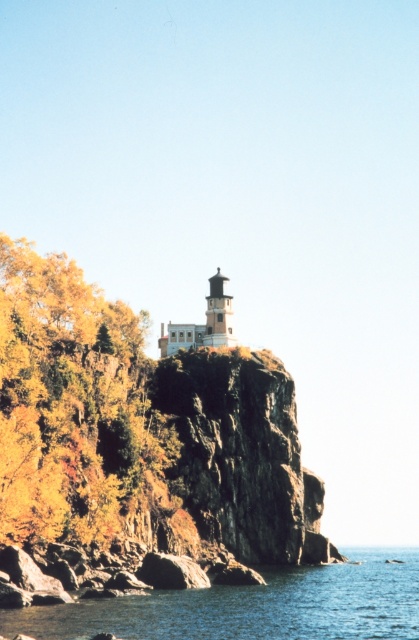
You are standing at the base of the cliff looking towards the lighthouse. There are two points marked on the cliff face. The first point is at coordinates point (121, 376) and the second point is at point (279, 609). Which point is closer to the lighthouse?

Point (121, 376) is behind point (279, 609), so the point closer to the lighthouse would be point (279, 609) since it is in front.